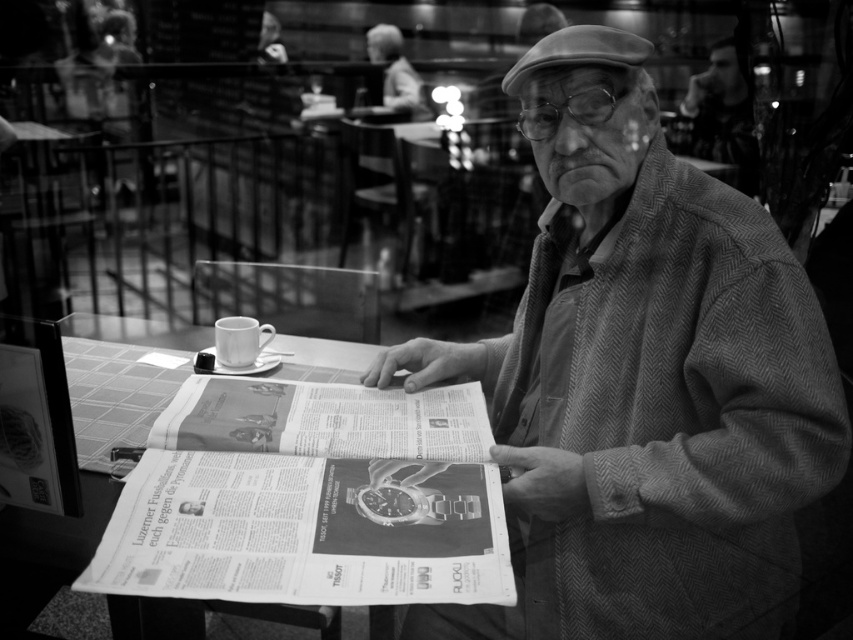
From the picture: You are a tailor who needs to determine if the herringbone wool coat at center can be folded and placed inside the paper at center without damaging the coat. Based on the size comparison, what would you advise?

The herringbone wool coat at center is smaller than the paper at center, so it can be folded and placed inside the paper at center without damaging the coat.

You are a tailor standing 30 inches away from the herringbone wool coat at center. Can you reach the coat without moving closer?

The herringbone wool coat at center is 33.09 inches away from the viewer. Since you are standing 30 inches away, you are closer than the stated distance, so you can reach the coat without moving closer.

You are a tailor who needs to reach the paper at center to check the pattern for the herringbone wool coat at center. Since the coat is above the paper, can you move the coat to access the paper?

The herringbone wool coat at center is located above the paper at center, so you can move the coat to access the paper.